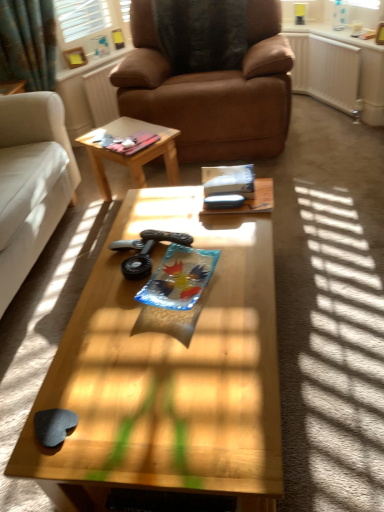
Find the location of a particular element. The width and height of the screenshot is (384, 512). free space to the right of black plastic game controller at center is located at coordinates (215, 244).